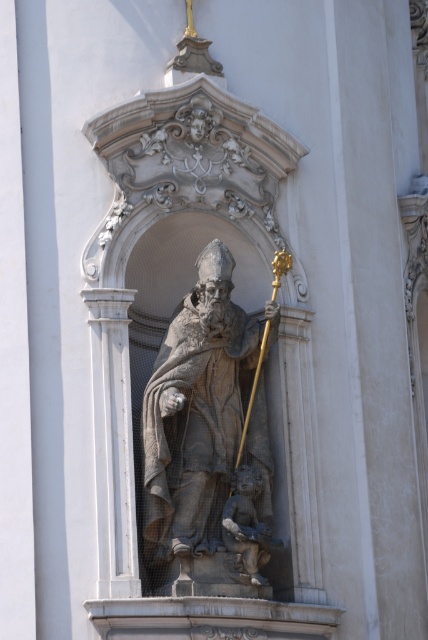
Question: Among these points, which one is farthest from the camera?

Choices:
 (A) (237, 525)
 (B) (189, 576)

Answer: (A)

Question: Does gray stone statue at center have a smaller size compared to smooth stone cherub at lower center?

Choices:
 (A) no
 (B) yes

Answer: (A)

Question: Can you confirm if gray stone statue at center is positioned below smooth stone cherub at lower center?

Choices:
 (A) no
 (B) yes

Answer: (A)

Question: Which point is farther to the camera?

Choices:
 (A) gray stone statue at center
 (B) smooth stone cherub at lower center

Answer: (B)

Question: Is gray stone statue at center further to the viewer compared to smooth stone cherub at lower center?

Choices:
 (A) no
 (B) yes

Answer: (A)

Question: Which of the following is the farthest from the observer?

Choices:
 (A) smooth stone cherub at lower center
 (B) gray stone statue at center

Answer: (A)